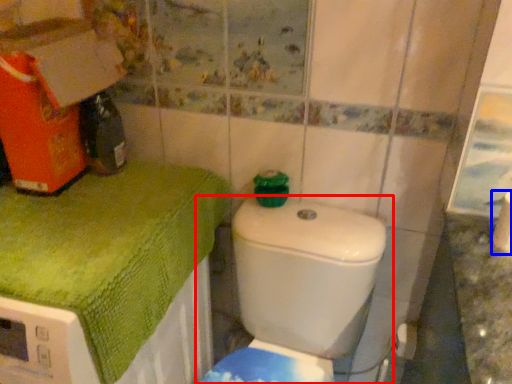
Question: Which object is further to the camera taking this photo, toilet (highlighted by a red box) or toilet paper (highlighted by a blue box)?

Choices:
 (A) toilet
 (B) toilet paper

Answer: (B)